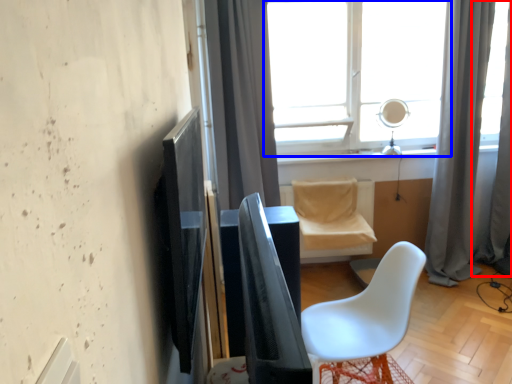
Question: Which point is further to the camera, curtain (highlighted by a red box) or window (highlighted by a blue box)?

Choices:
 (A) curtain
 (B) window

Answer: (B)